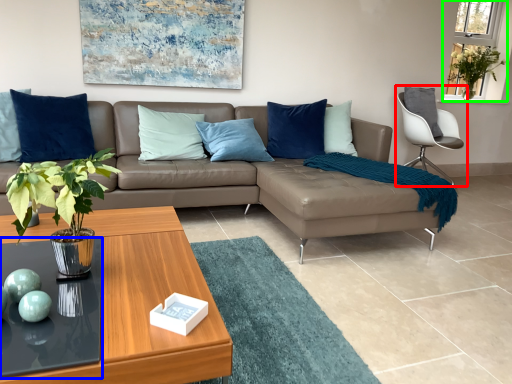
Question: Which is farther away from chair (highlighted by a red box)? glass table (highlighted by a blue box) or window screen (highlighted by a green box)?

Choices:
 (A) glass table
 (B) window screen

Answer: (A)